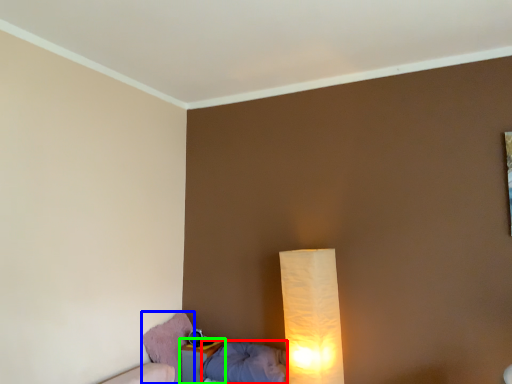
Question: Estimate the real-world distances between objects in this image. Which object is farther from pillow (highlighted by a red box), swivel chair (highlighted by a blue box) or nightstand (highlighted by a green box)?

Choices:
 (A) swivel chair
 (B) nightstand

Answer: (A)